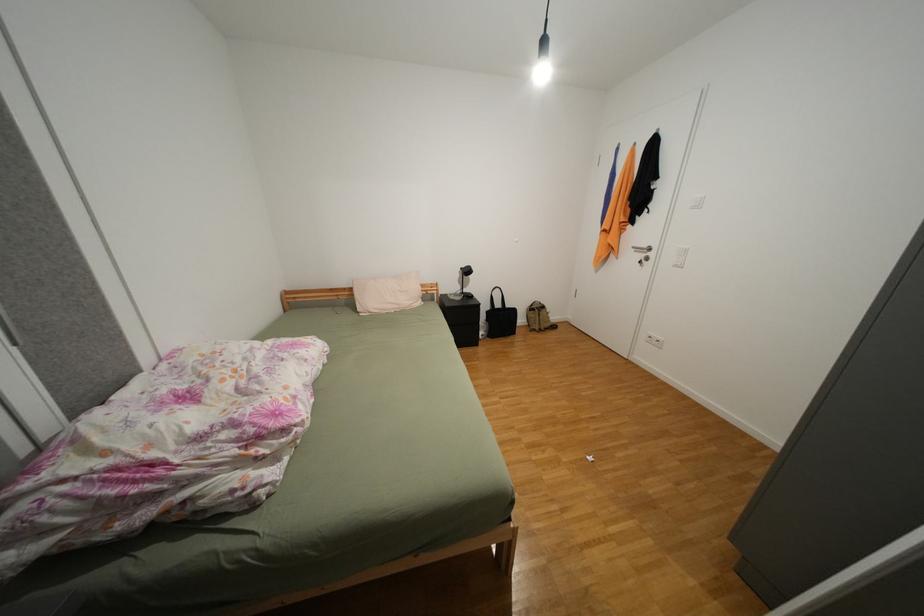
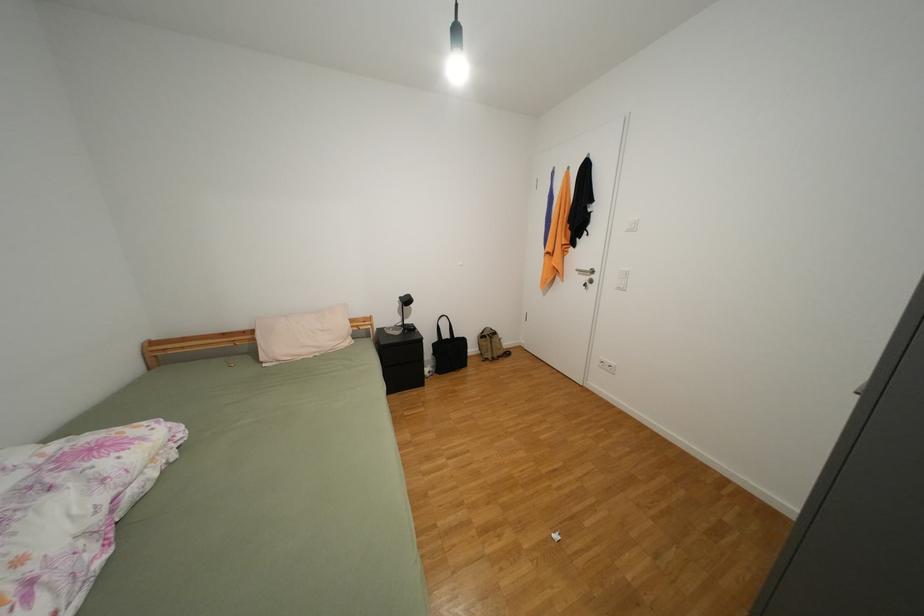
What movement of the cameraman would produce the second image?

The cameraman moved toward right, forward.